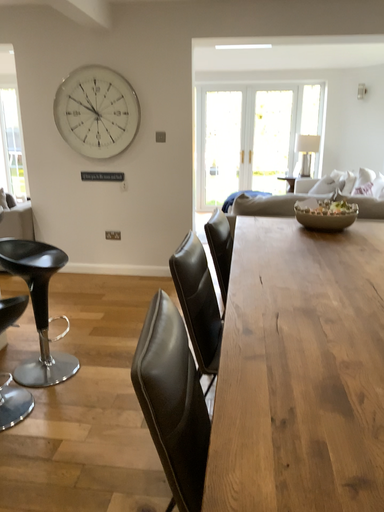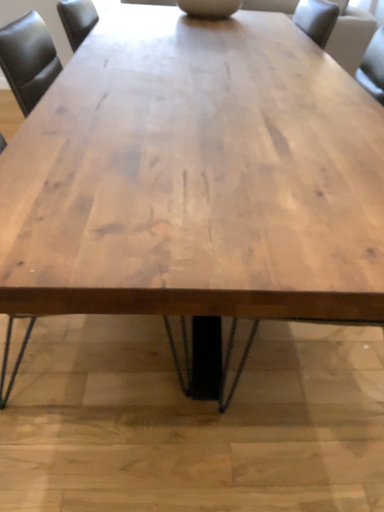
Question: Which way did the camera rotate in the video?

Choices:
 (A) rotated right
 (B) rotated left

Answer: (A)